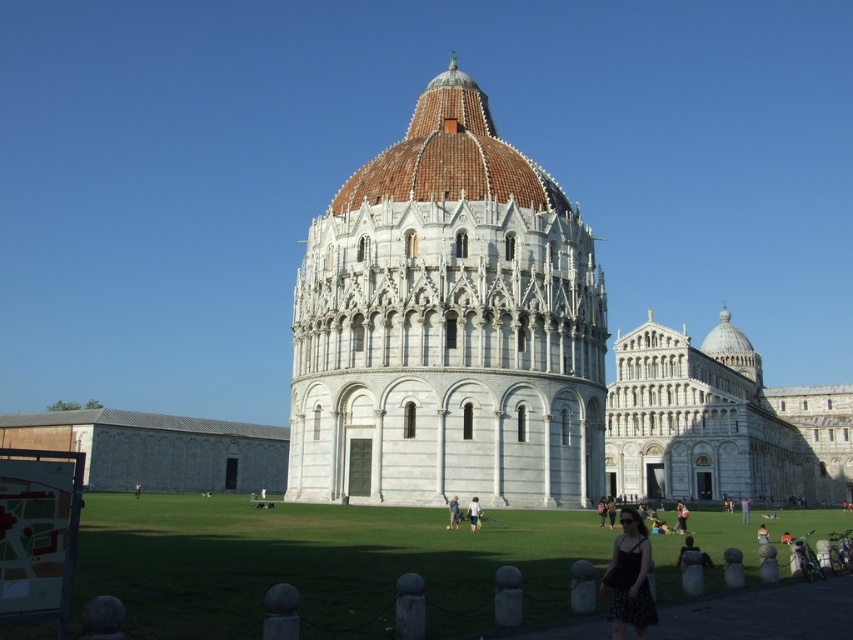
Looking at this image, you are standing in Piazza dei Miracoli and want to take a photo of the brown tiled dome at center and the light brown leather jacket at center. Which object should you focus on first to ensure both are in the frame?

You should focus on the brown tiled dome at center first because it is closer to you than the light brown leather jacket at center, ensuring both are in the frame.

You are standing in Piazza dei Miracoli in Pisa, Italy, and you want to take a photo of the brown tiled dome at center. If your camera can focus on objects up to 50 meters away, will you be able to capture the dome clearly?

The brown tiled dome at center and the camera are 49.09 meters apart, which is within the camera focus range of up to 50 meters. Therefore, you can capture the dome clearly.

You are standing in the Piazza dei Miracoli in Pisa and see the white marble tower at center and the light brown leather jacket at center. Which object is wider?

The white marble tower at center is wider than the light brown leather jacket at center according to the description.